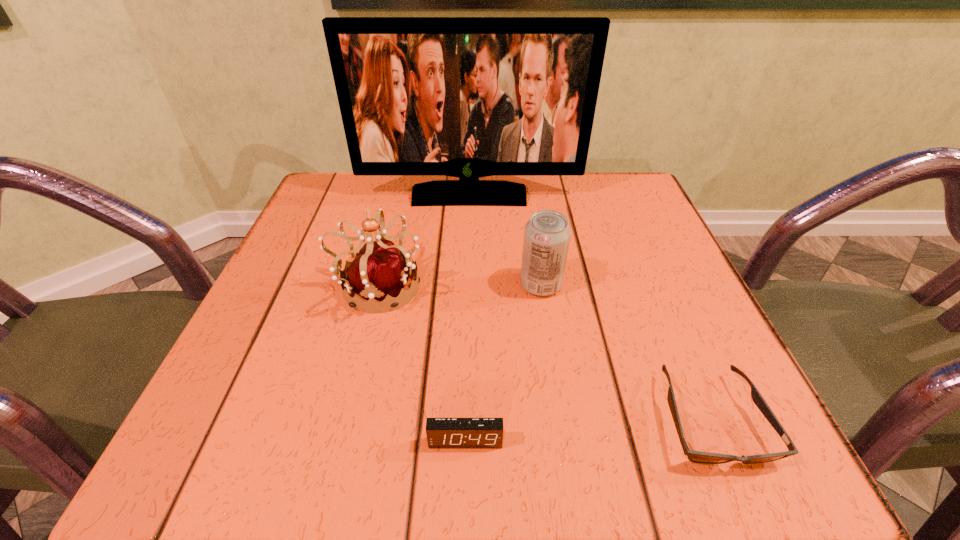
Where is `object that is at the far edge`? object that is at the far edge is located at coordinates point(468,97).

Where is `alarm clock positioned at the near edge`? alarm clock positioned at the near edge is located at coordinates (441, 432).

Identify the location of sunglasses at the near edge. This screenshot has width=960, height=540. (694, 456).

Image resolution: width=960 pixels, height=540 pixels. Identify the location of monitor at the left edge. (468, 97).

Where is `tiara that is at the left edge`? tiara that is at the left edge is located at coordinates (379, 271).

I want to click on monitor that is at the right edge, so click(468, 97).

At what (x,y) coordinates should I click in order to perform the action: click on sunglasses that is at the right edge. Please return your answer as a coordinate pair (x, y). The height and width of the screenshot is (540, 960). Looking at the image, I should click on (694, 456).

I want to click on object at the far left corner, so click(468, 97).

In order to click on object at the far right corner in this screenshot , I will do `click(468, 97)`.

In order to click on object situated at the near right corner in this screenshot , I will do `click(694, 456)`.